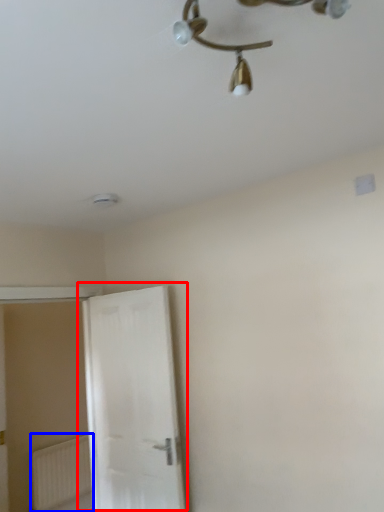
Question: Which object appears closest to the camera in this image, door (highlighted by a red box) or radiator (highlighted by a blue box)?

Choices:
 (A) door
 (B) radiator

Answer: (A)